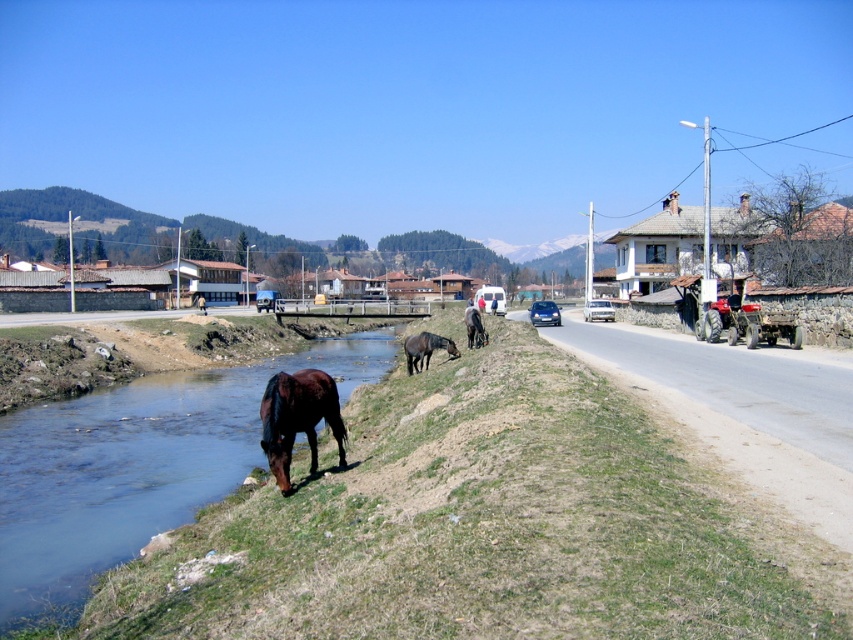
Question: Which of the following is the farthest from the observer?

Choices:
 (A) (469, 339)
 (B) (144, 442)
 (C) (589, 404)

Answer: (A)

Question: Does green grass at lower left come behind brown glossy horse at lower center?

Choices:
 (A) no
 (B) yes

Answer: (A)

Question: Based on their relative distances, which object is nearer to the brown glossy horse at center?

Choices:
 (A) brown glossy horse at lower center
 (B) brown grassy stream at lower left
 (C) green grass at lower left

Answer: (A)

Question: Can you confirm if green grass at lower left is bigger than brown glossy horse at center?

Choices:
 (A) yes
 (B) no

Answer: (B)

Question: Observing the image, what is the correct spatial positioning of brown grassy stream at lower left in reference to brown glossy horse at lower left?

Choices:
 (A) right
 (B) left

Answer: (B)

Question: Which is farther from the green grass at lower left?

Choices:
 (A) brown glossy horse at lower left
 (B) brown glossy horse at lower center
 (C) brown grassy stream at lower left

Answer: (B)